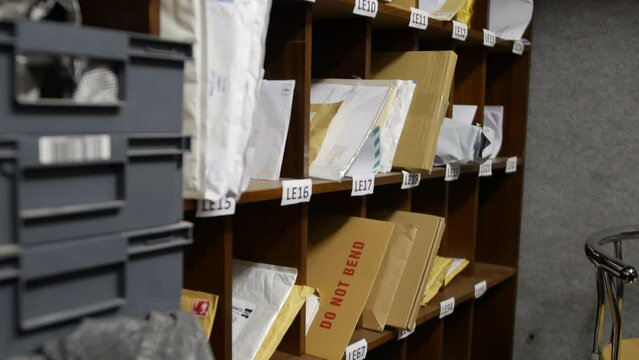
Find the location of a particular element. cabinet is located at coordinates (512, 245).